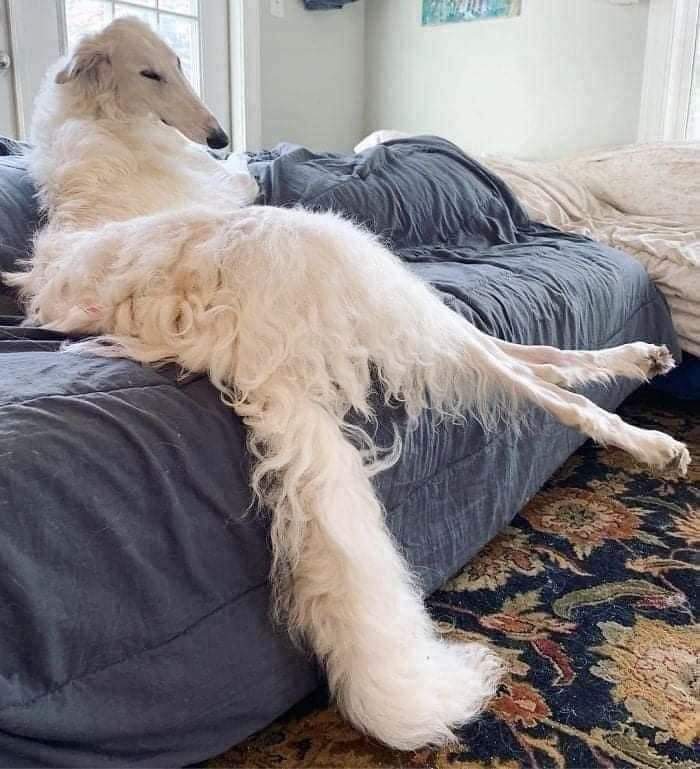
This screenshot has width=700, height=769. I want to click on rug, so click(612, 657).